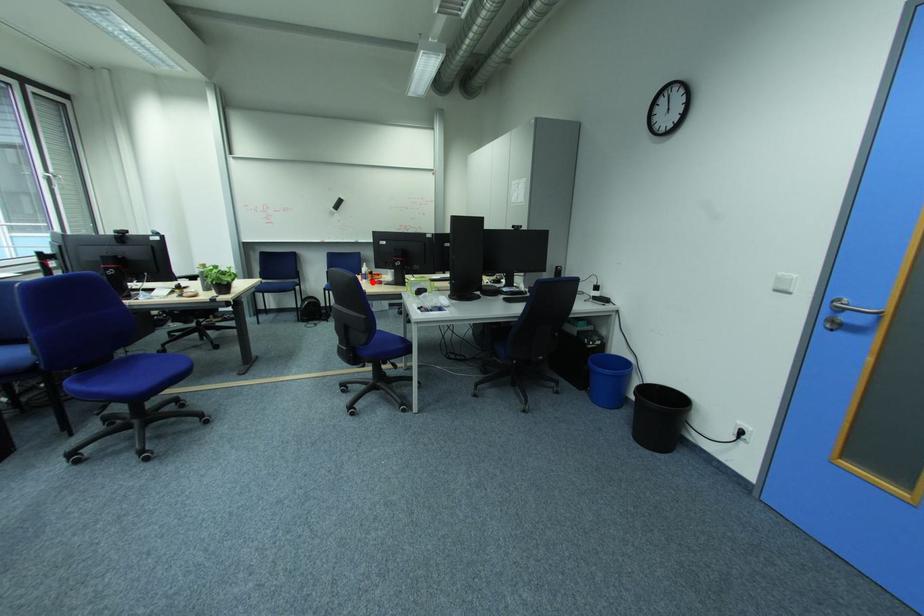
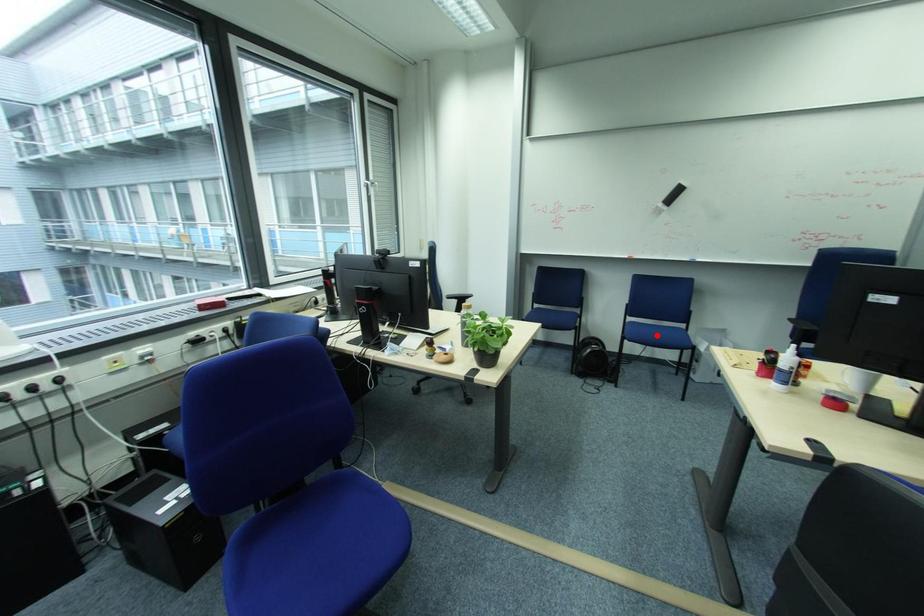
I am providing you with two images of the same scene from different viewpoints. A red point is marked on the first image and another point is marked on the second image. Is the marked point in image1 the same physical position as the marked point in image2?

No